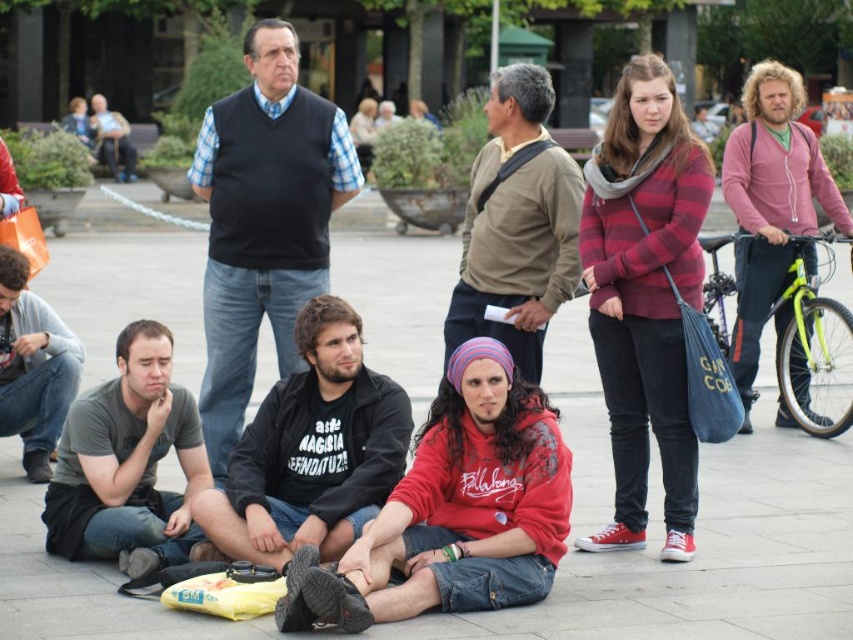
Question: Where is red fleece at center located in relation to fluffy pink sweater at right in the image?

Choices:
 (A) below
 (B) above

Answer: (A)

Question: Can you confirm if dark blue sweater at center is positioned below brown cotton shirt at center?

Choices:
 (A) yes
 (B) no

Answer: (A)

Question: Is red fleece at center closer to the viewer compared to fluffy pink sweater at right?

Choices:
 (A) yes
 (B) no

Answer: (A)

Question: Which point is farther to the camera?

Choices:
 (A) (347, 307)
 (B) (234, 369)

Answer: (B)

Question: Which point is farther from the camera taking this photo?

Choices:
 (A) click(485, 371)
 (B) click(57, 349)

Answer: (B)

Question: Which object appears farthest from the camera in this image?

Choices:
 (A) red fleece at center
 (B) dark blue sweater at center

Answer: (B)